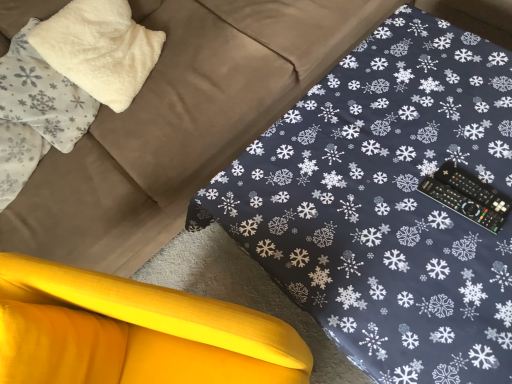
Locate an element on the screen. This screenshot has width=512, height=384. empty space that is to the right of black plastic remote at right is located at coordinates (490, 162).